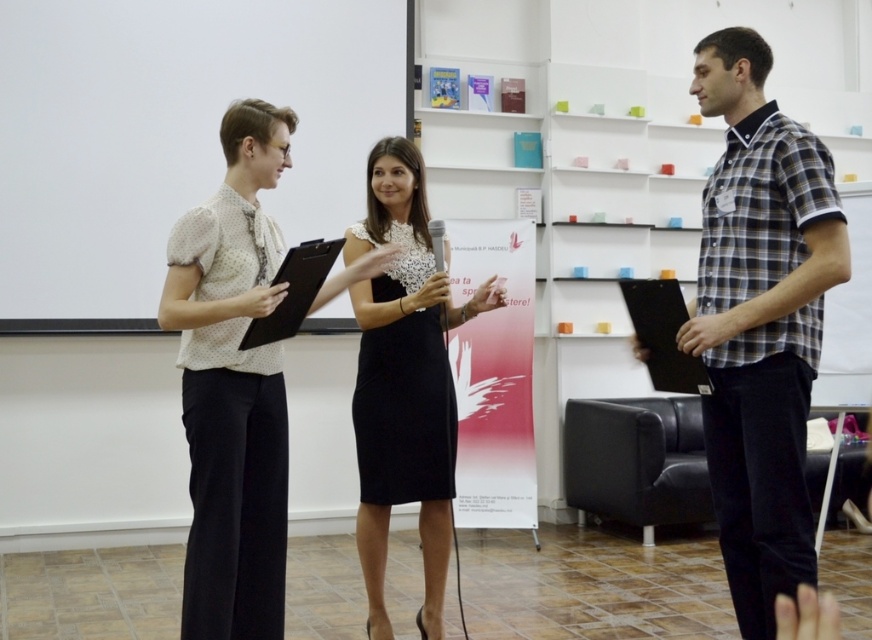
Question: Among these points, which one is farthest from the camera?

Choices:
 (A) 655,346
 (B) 182,145

Answer: (B)

Question: Is white paperboard at center wider than black matte clipboard at right?

Choices:
 (A) yes
 (B) no

Answer: (A)

Question: Among these points, which one is farthest from the camera?

Choices:
 (A) (205, 90)
 (B) (355, 403)
 (C) (780, 250)

Answer: (A)

Question: Can you confirm if matte white blouse at center is bigger than black matte clipboard at center?

Choices:
 (A) no
 (B) yes

Answer: (B)

Question: Which of these objects is positioned farthest from the black matte clipboard at center?

Choices:
 (A) checkered fabric shirt at right
 (B) white paperboard at center
 (C) black lace dress at center
 (D) black matte clipboard at right

Answer: (B)

Question: Does white paperboard at center have a greater width compared to matte white blouse at center?

Choices:
 (A) no
 (B) yes

Answer: (B)